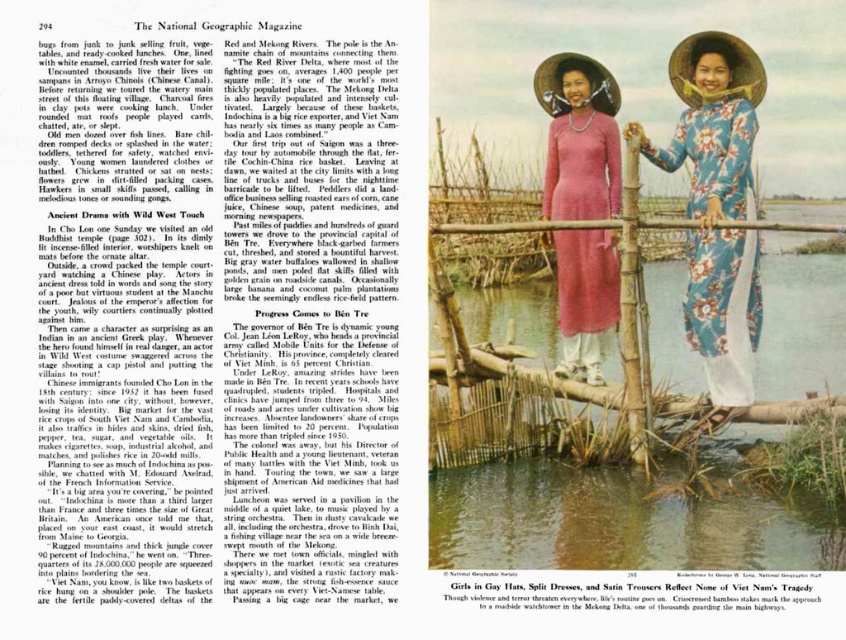
You are a photographer standing on the bamboo bridge in the Mekong Delta. You want to take a photo of both the floral silk ao dai at center and the pink silk dress at center. If your camera has a lens that can capture objects up to 5 feet apart in the frame, will you be able to include both in a single shot?

The floral silk ao dai at center and pink silk dress at center are 5.13 feet apart from each other. Since the distance between them exceeds the camera lens limit of 5 feet, you cannot capture both in a single shot without moving closer or using a different lens.